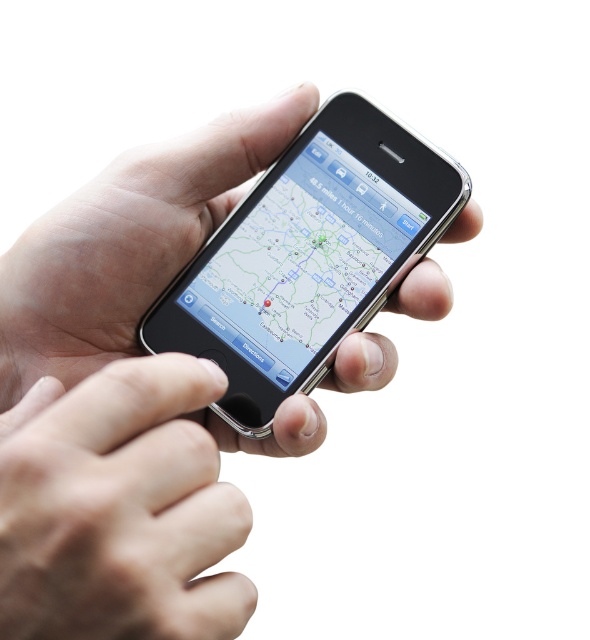
Based on the photo, does silver metallic phone at center have a smaller size compared to smooth skin hand at center?

No, silver metallic phone at center is not smaller than smooth skin hand at center.

This screenshot has height=640, width=590. Describe the element at coordinates (127, 401) in the screenshot. I see `silver metallic phone at center` at that location.

Locate an element on the screen. silver metallic phone at center is located at coordinates (127, 401).

Between silver metallic phone at center and sleek silver phone at center, which one appears on the left side from the viewer's perspective?

From the viewer's perspective, silver metallic phone at center appears more on the left side.

Which is behind, point (0, 324) or point (358, 129)?

Point (358, 129)

Is point (217, 465) farther from viewer compared to point (280, 205)?

No, (217, 465) is closer to viewer.

Locate an element on the screen. silver metallic phone at center is located at coordinates (127, 401).

Can you confirm if smooth skin hand at center is shorter than sleek silver phone at center?

Correct, smooth skin hand at center is not as tall as sleek silver phone at center.

Between smooth skin hand at center and sleek silver phone at center, which one appears on the left side from the viewer's perspective?

From the viewer's perspective, smooth skin hand at center appears more on the left side.

What do you see at coordinates (119, 508) in the screenshot? The image size is (590, 640). I see `smooth skin hand at center` at bounding box center [119, 508].

This screenshot has width=590, height=640. In order to click on smooth skin hand at center in this screenshot , I will do `click(119, 508)`.